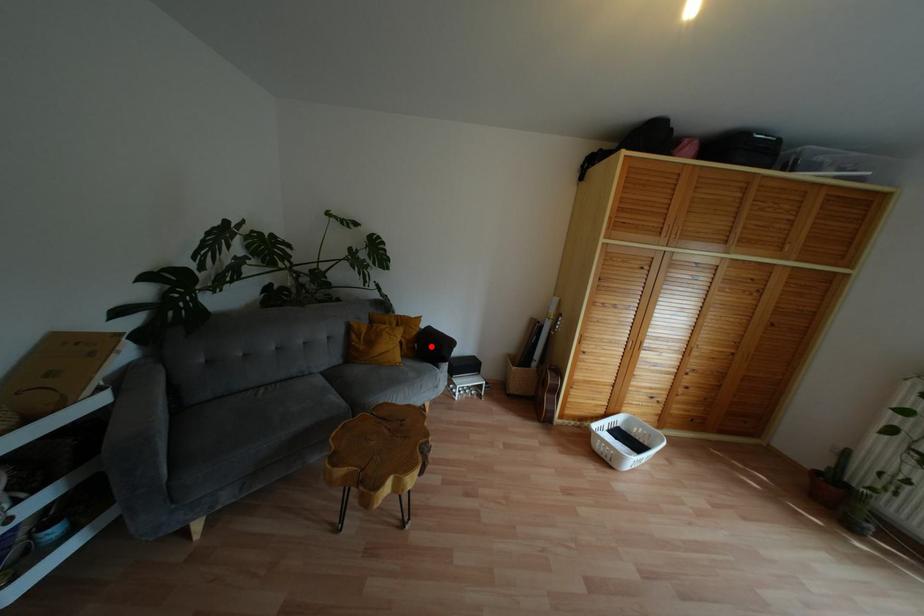
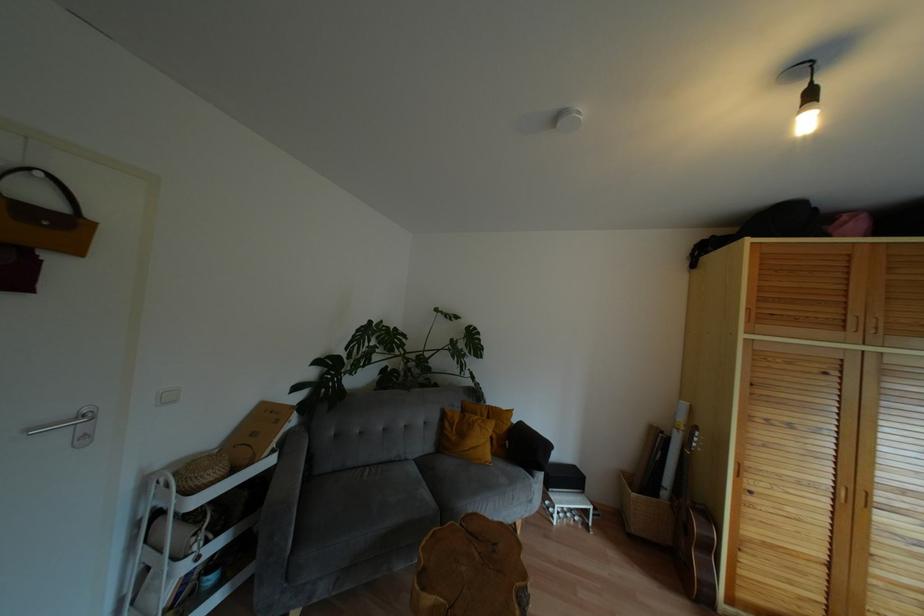
Question: I am providing you with two images of the same scene from different viewpoints. Given a red point in image1, look at the same physical point in image2. Is it:

Choices:
 (A) Closer to the viewpoint
 (B) Farther from the viewpoint

Answer: (B)